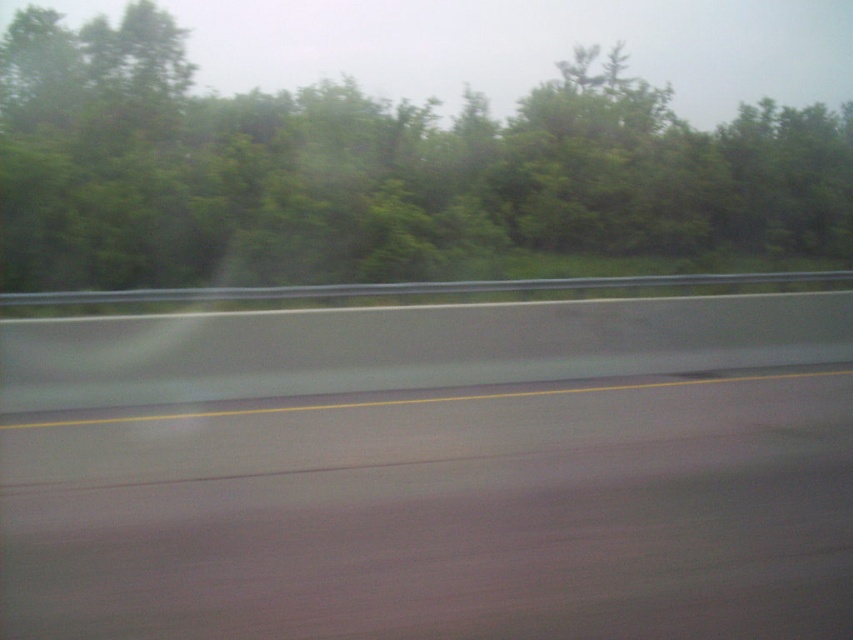
You are a driver approaching the smooth asphalt highway at center and the green leafy tree at upper center. Which object appears larger in the scene?

The green leafy tree at upper center appears larger than the smooth asphalt highway at center in the scene.

You are driving a car and need to stop suddenly. There is a guardrail and a point at coordinates [318,596] in your view. If the guardrail is 3 meters away from you, is the point closer to you than the guardrail?

The point at coordinates [318,596] is 5.02 meters from the viewer, which is farther than the guardrail at 3 meters. Therefore, the point is not closer than the guardrail.